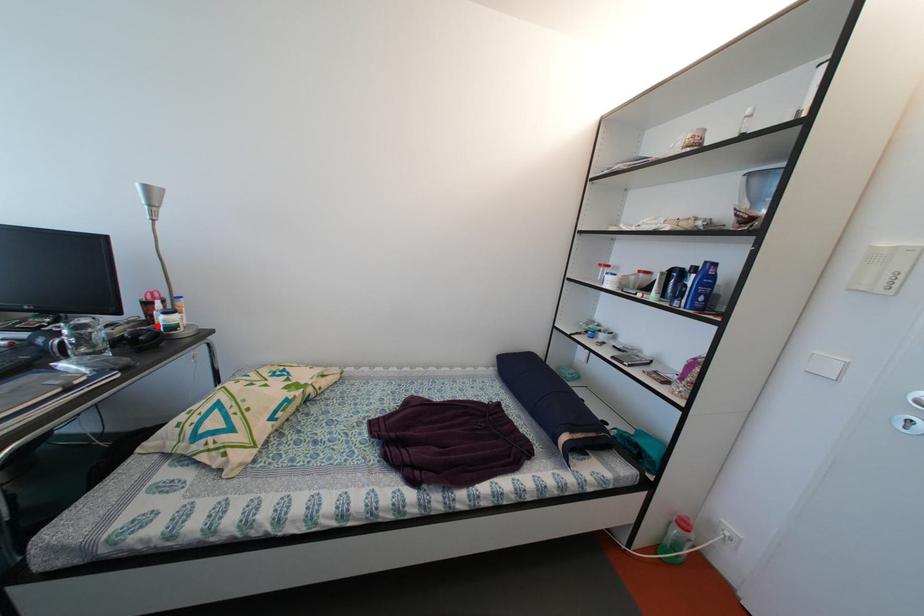
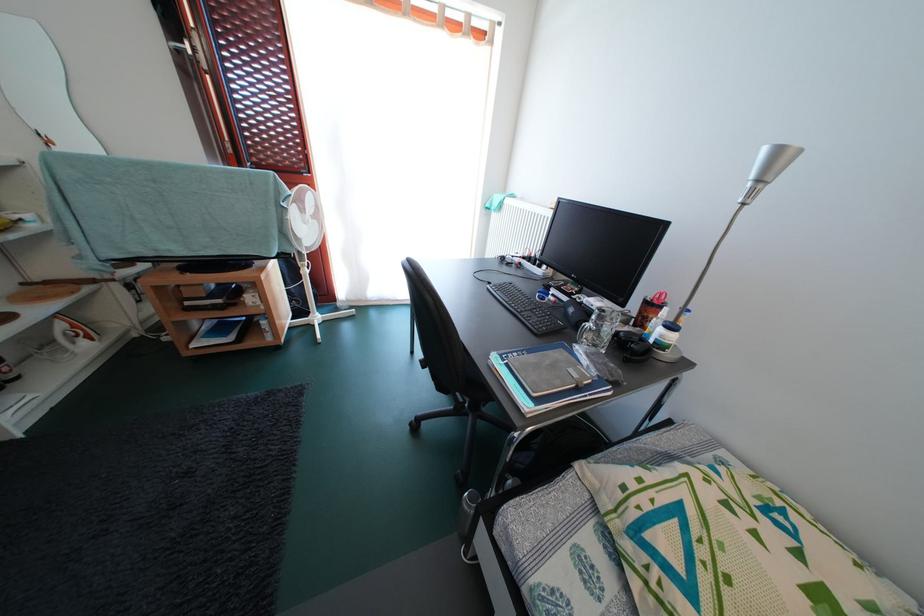
The point at the highlighted location is marked in the first image. Where is the corresponding point in the second image?

(648, 328)